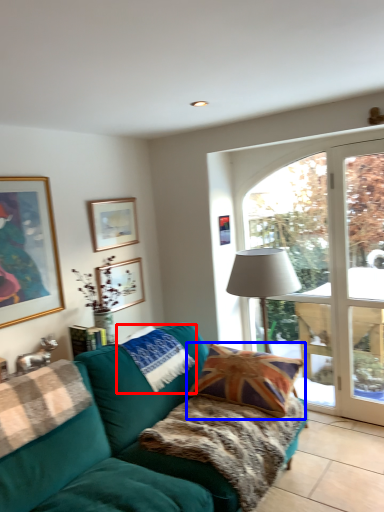
Question: Among these objects, which one is nearest to the camera, pillow (highlighted by a red box) or pillow (highlighted by a blue box)?

Choices:
 (A) pillow
 (B) pillow

Answer: (B)